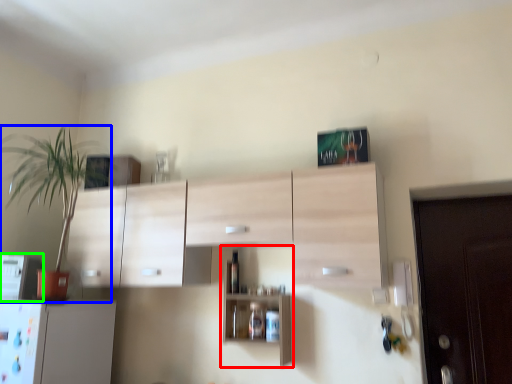
Question: Which is farther away from shelf (highlighted by a red box)? houseplant (highlighted by a blue box) or appliance (highlighted by a green box)?

Choices:
 (A) houseplant
 (B) appliance

Answer: (A)